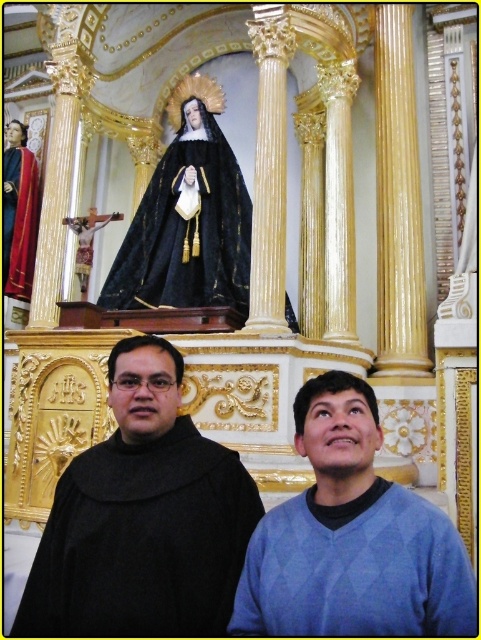
Between black matte robe at center and black velvet robe at upper center, which one appears on the left side from the viewer's perspective?

From the viewer's perspective, black velvet robe at upper center appears more on the left side.

Who is lower down, black matte robe at center or black velvet robe at upper center?

Positioned lower is black matte robe at center.

This screenshot has width=481, height=640. Describe the element at coordinates (142, 518) in the screenshot. I see `black matte robe at center` at that location.

The image size is (481, 640). Find the location of `black matte robe at center`. black matte robe at center is located at coordinates click(x=142, y=518).

Who is taller, black matte robe at center or blue sweater at lower right?

Standing taller between the two is black matte robe at center.

Find the location of a particular element. black matte robe at center is located at coordinates (142, 518).

At what (x,y) coordinates should I click in order to perform the action: click on black matte robe at center. Please return your answer as a coordinate pair (x, y). Looking at the image, I should click on (142, 518).

Is point (354, 436) farther from viewer compared to point (150, 198)?

That is False.

Is the position of blue sweater at lower right more distant than that of black velvet robe at upper center?

No, it is in front of black velvet robe at upper center.

Where is `blue sweater at lower right`? blue sweater at lower right is located at coordinates (352, 538).

Find the location of a particular element. The image size is (481, 640). blue sweater at lower right is located at coordinates (352, 538).